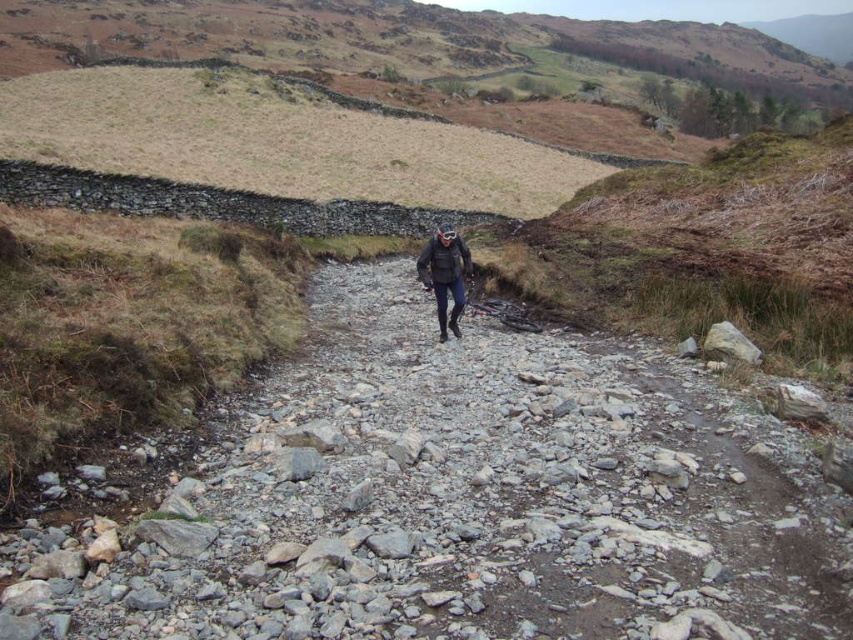
You are a hiker trying to cross the gray rocky trail at center while avoiding the dark gray jacket at center. Which object should you navigate around first?

The gray rocky trail at center is in front of the dark gray jacket at center, so you should navigate around the gray rocky trail at center first before reaching the dark gray jacket at center.

You are planning to hike along the gray rocky trail at center while wearing the dark gray jacket at center. Based on their sizes, which item will require more space to store when packing your backpack?

The dark gray jacket at center requires more storage space because it is taller than the gray rocky trail at center.

You are planning to hike through the gray rocky trail at center while wearing the dark gray jacket at center. Considering the space each occupies, which one takes up more area in the image?

The dark gray jacket at center occupies more space than the gray rocky trail at center in the image.